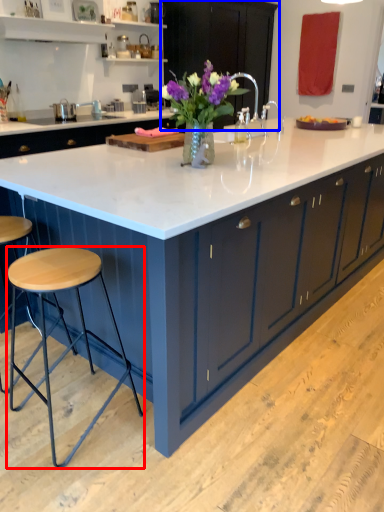
Question: Which object appears closest to the camera in this image, stool (highlighted by a red box) or cabinetry (highlighted by a blue box)?

Choices:
 (A) stool
 (B) cabinetry

Answer: (A)